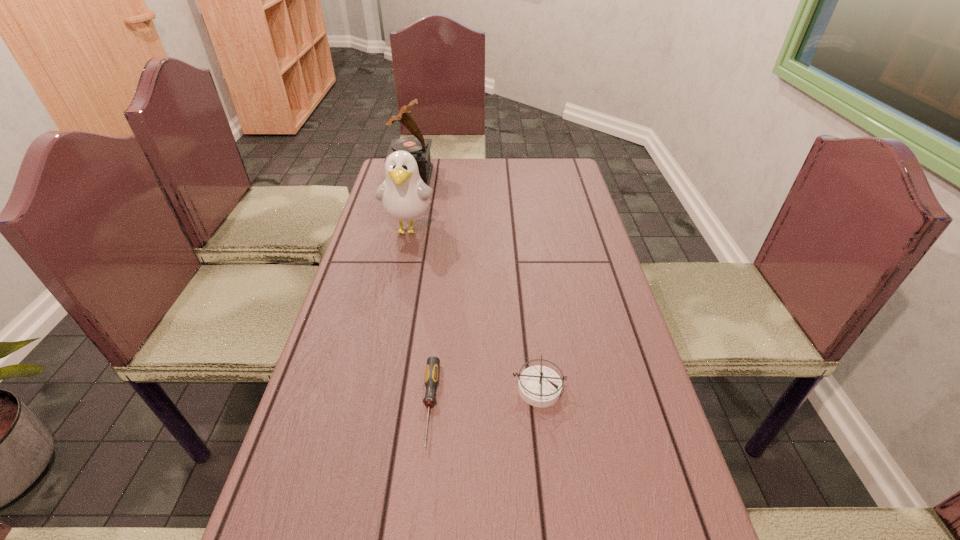
Find the location of a particular element. The width and height of the screenshot is (960, 540). free spot that satisfies the following two spatial constraints: 1. at the horn opening of the compass; 2. on the right side of the farthest object is located at coordinates (361, 389).

You are a GUI agent. You are given a task and a screenshot of the screen. Output one action in this format:
    pyautogui.click(x=<x>, y=<y>)
    Task: Click on the free space in the image that satisfies the following two spatial constraints: 1. on the beak of the compass; 2. on the left side of the gull
    This screenshot has width=960, height=540.
    Given the screenshot: What is the action you would take?
    pyautogui.click(x=375, y=389)